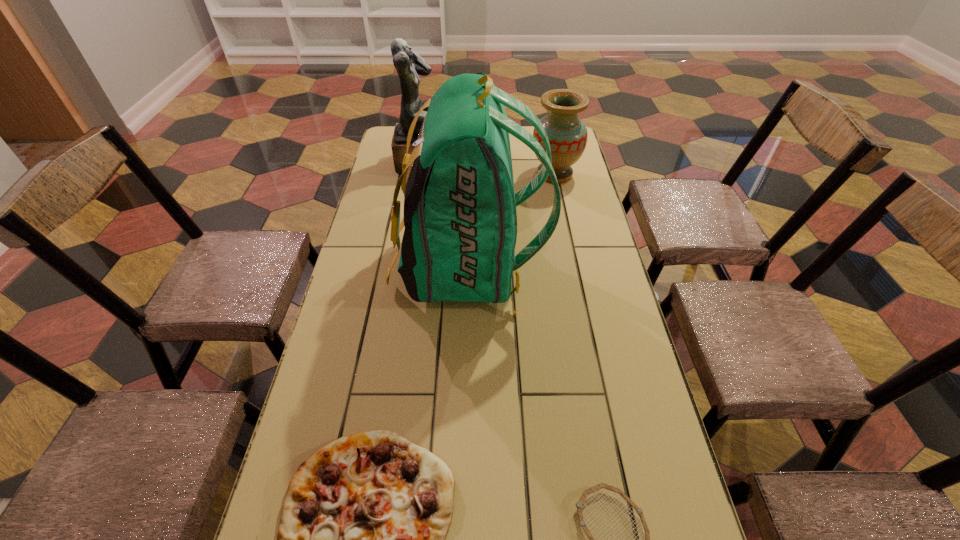
Image resolution: width=960 pixels, height=540 pixels. What are the coordinates of `backpack` in the screenshot? It's located at (460, 218).

Identify the location of the third nearest object. (460, 218).

Where is `sculpture`? The image size is (960, 540). sculpture is located at coordinates (409, 65).

Where is `vase`? The image size is (960, 540). vase is located at coordinates (567, 134).

Find the location of a particular element. vacant space situated on the back of the tallest object is located at coordinates (593, 267).

Where is `vacant point located 0.220m in a relaxed pose on the second tallest object`? This screenshot has width=960, height=540. vacant point located 0.220m in a relaxed pose on the second tallest object is located at coordinates (515, 164).

You are a GUI agent. You are given a task and a screenshot of the screen. Output one action in this format:
    pyautogui.click(x=<x>, y=<y>)
    Task: Click on the free location located on the left of the third shortest object
    The width and height of the screenshot is (960, 540).
    Given the screenshot: What is the action you would take?
    pos(468,174)

The width and height of the screenshot is (960, 540). I want to click on object present at the far edge, so click(x=409, y=65).

The image size is (960, 540). I want to click on backpack that is at the left edge, so tap(460, 218).

Where is `sculpture present at the left edge`? This screenshot has width=960, height=540. sculpture present at the left edge is located at coordinates (409, 65).